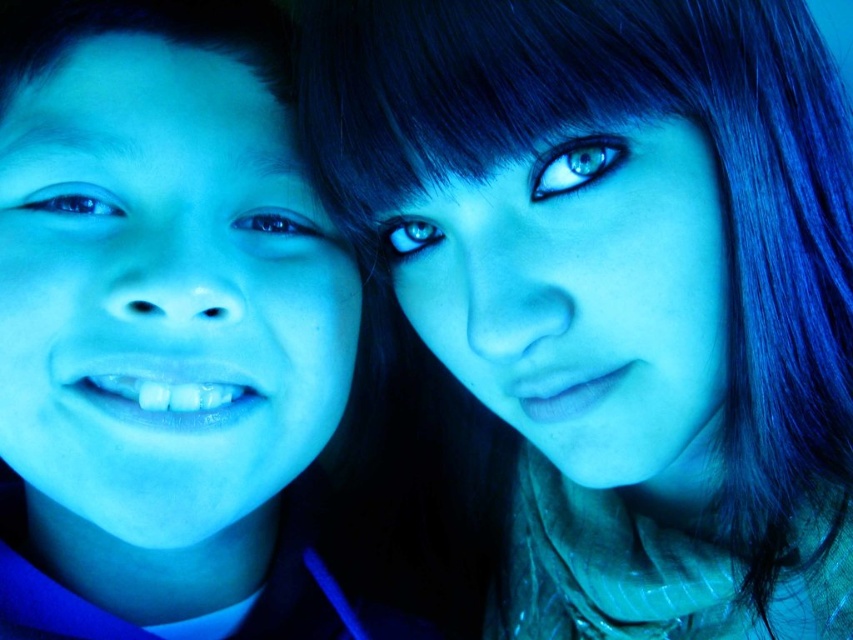
You are a photographer trying to capture a closeup shot of the blue matte hair at upper right and the matte blue face at left. Which object should you focus on first if you want to ensure both are in focus without adjusting the camera settings?

The blue matte hair at upper right is above matte blue face at left, so focusing on the matte blue face at left first would allow the blue matte hair at upper right to also be in focus since it is closer to the camera.

Looking at this image, you are a photographer adjusting the focus of your camera. The camera has a focus point at coordinate point 0.452, 0.727. Which object in the image should you focus on to capture the blue matte hair at upper right?

The blue matte hair at upper right is located at point (619, 289), so you should focus on the blue matte hair at upper right to capture it clearly.

You are standing in front of the image and want to touch the point at coordinates point (738, 83). If your hand can reach up to 18 inches, will you be able to reach it?

The point (738, 83) is 18.31 inches away from the viewer, so your hand can reach it since it is within the 18 inches limit.